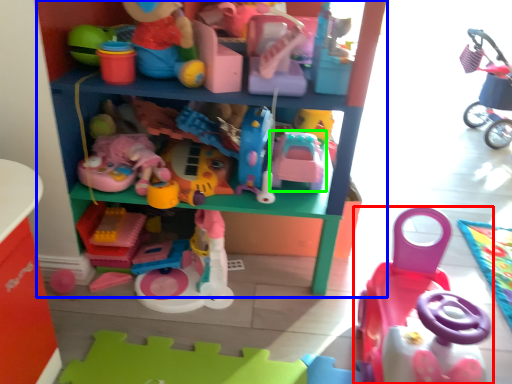
Question: Which object is the closest to the toy (highlighted by a red box)? Choose among these: shelf (highlighted by a blue box) or toy (highlighted by a green box).

Choices:
 (A) shelf
 (B) toy

Answer: (B)